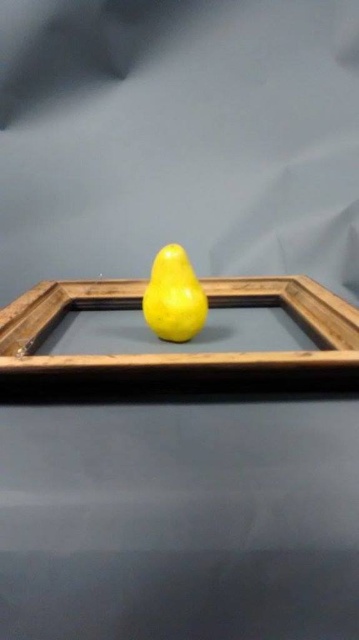
Question: Which of the following is the farthest from the observer?

Choices:
 (A) (104, 372)
 (B) (160, 301)

Answer: (B)

Question: Does wooden frame at center have a larger size compared to yellow matte pear at center?

Choices:
 (A) yes
 (B) no

Answer: (A)

Question: Which of the following is the closest to the observer?

Choices:
 (A) yellow matte pear at center
 (B) wooden frame at center

Answer: (B)

Question: In this image, where is wooden frame at center located relative to yellow matte pear at center?

Choices:
 (A) above
 (B) below

Answer: (B)

Question: Does wooden frame at center have a larger size compared to yellow matte pear at center?

Choices:
 (A) no
 (B) yes

Answer: (B)